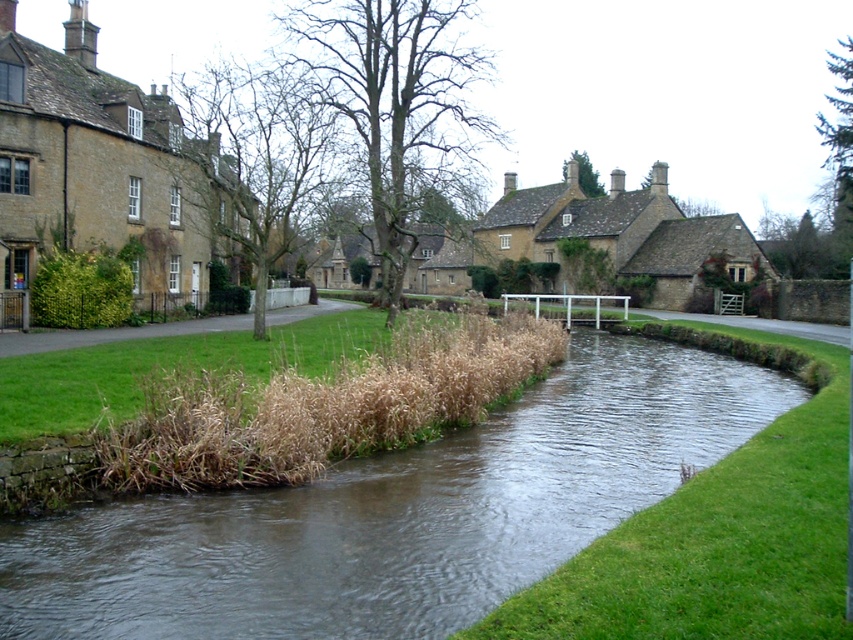
Question: Is brown grassy stream at center to the right of matte stone houses at center from the viewer's perspective?

Choices:
 (A) no
 (B) yes

Answer: (B)

Question: In this image, where is brown grassy stream at center located relative to matte stone houses at center?

Choices:
 (A) left
 (B) right

Answer: (B)

Question: Which of the following is the closest to the observer?

Choices:
 (A) (229, 536)
 (B) (56, 10)

Answer: (A)

Question: Which object appears farthest from the camera in this image?

Choices:
 (A) matte stone houses at center
 (B) brown grassy stream at center

Answer: (A)

Question: Does brown grassy stream at center have a larger size compared to matte stone houses at center?

Choices:
 (A) no
 (B) yes

Answer: (A)